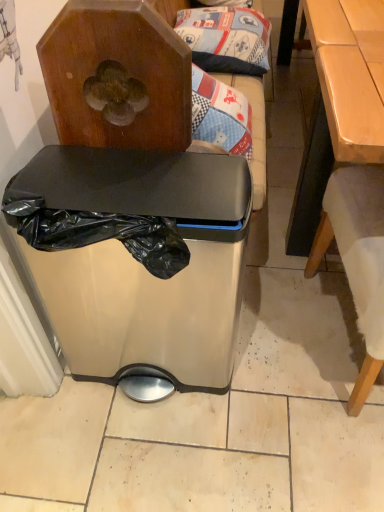
Question: Is light brown wooden table at right bigger than satin silver trash can at center?

Choices:
 (A) yes
 (B) no

Answer: (A)

Question: Is light brown wooden table at right located outside satin silver trash can at center?

Choices:
 (A) yes
 (B) no

Answer: (A)

Question: Is satin silver trash can at center at the back of light brown wooden table at right?

Choices:
 (A) no
 (B) yes

Answer: (B)

Question: Considering the relative sizes of light brown wooden table at right and satin silver trash can at center in the image provided, is light brown wooden table at right taller than satin silver trash can at center?

Choices:
 (A) no
 (B) yes

Answer: (B)

Question: Is light brown wooden table at right next to satin silver trash can at center?

Choices:
 (A) no
 (B) yes

Answer: (A)

Question: Can you confirm if light brown wooden table at right is thinner than satin silver trash can at center?

Choices:
 (A) yes
 (B) no

Answer: (B)

Question: Is light brown wooden table at right turned away from patterned fabric pillow at upper center?

Choices:
 (A) no
 (B) yes

Answer: (B)

Question: Can you confirm if light brown wooden table at right is bigger than patterned fabric pillow at upper center?

Choices:
 (A) no
 (B) yes

Answer: (B)

Question: Is light brown wooden table at right wider than patterned fabric pillow at upper center?

Choices:
 (A) yes
 (B) no

Answer: (A)

Question: Is light brown wooden table at right taller than patterned fabric pillow at upper center?

Choices:
 (A) yes
 (B) no

Answer: (A)

Question: From a real-world perspective, does light brown wooden table at right sit lower than patterned fabric pillow at upper center?

Choices:
 (A) yes
 (B) no

Answer: (A)

Question: Is light brown wooden table at right to the left of patterned fabric pillow at upper center from the viewer's perspective?

Choices:
 (A) yes
 (B) no

Answer: (B)

Question: Is patterned fabric pillow at upper center next to satin silver trash can at center and touching it?

Choices:
 (A) no
 (B) yes

Answer: (A)